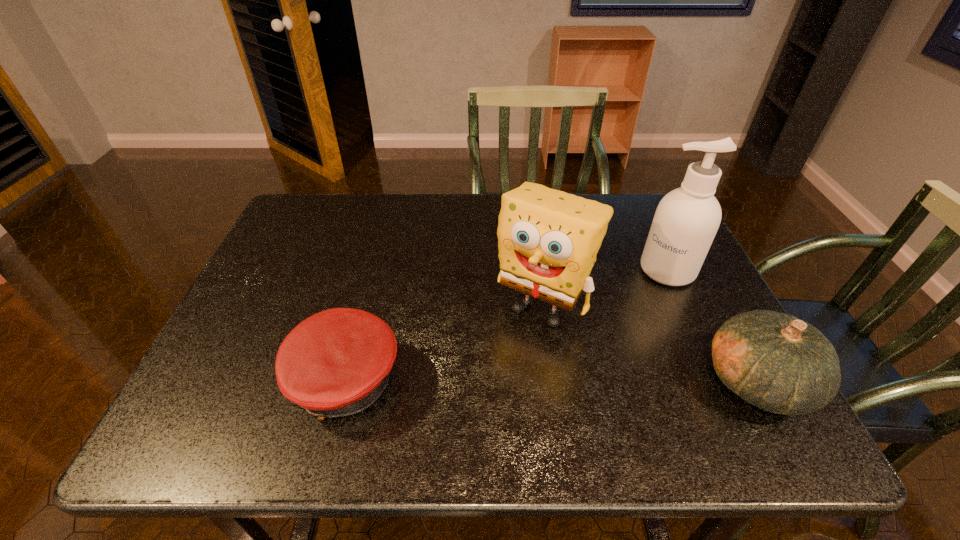
Where is `the leftmost object`? This screenshot has height=540, width=960. the leftmost object is located at coordinates (337, 362).

Image resolution: width=960 pixels, height=540 pixels. I want to click on cap, so click(337, 362).

The height and width of the screenshot is (540, 960). In order to click on the second shortest object in this screenshot , I will do click(x=781, y=364).

Where is `cleansing agent`? The height and width of the screenshot is (540, 960). cleansing agent is located at coordinates (686, 220).

Where is `the second object from left to right`? the second object from left to right is located at coordinates (548, 240).

Locate an element on the screen. sponge is located at coordinates (548, 240).

Locate an element on the screen. blank area located 0.150m on the front of the leftmost object with an emblem is located at coordinates (212, 382).

Find the location of `vacant space located on the front of the leftmost object with an emblem`. vacant space located on the front of the leftmost object with an emblem is located at coordinates (227, 382).

The height and width of the screenshot is (540, 960). Find the location of `blank area located 0.120m on the front of the leftmost object with an emblem`. blank area located 0.120m on the front of the leftmost object with an emblem is located at coordinates (227, 382).

Locate an element on the screen. The width and height of the screenshot is (960, 540). free region located 0.170m on the back of the gourd is located at coordinates (708, 288).